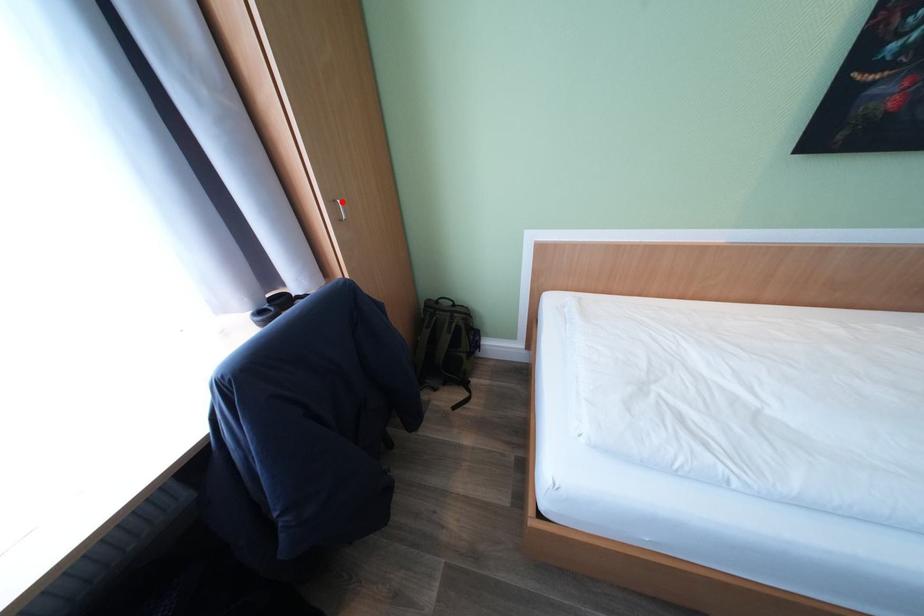
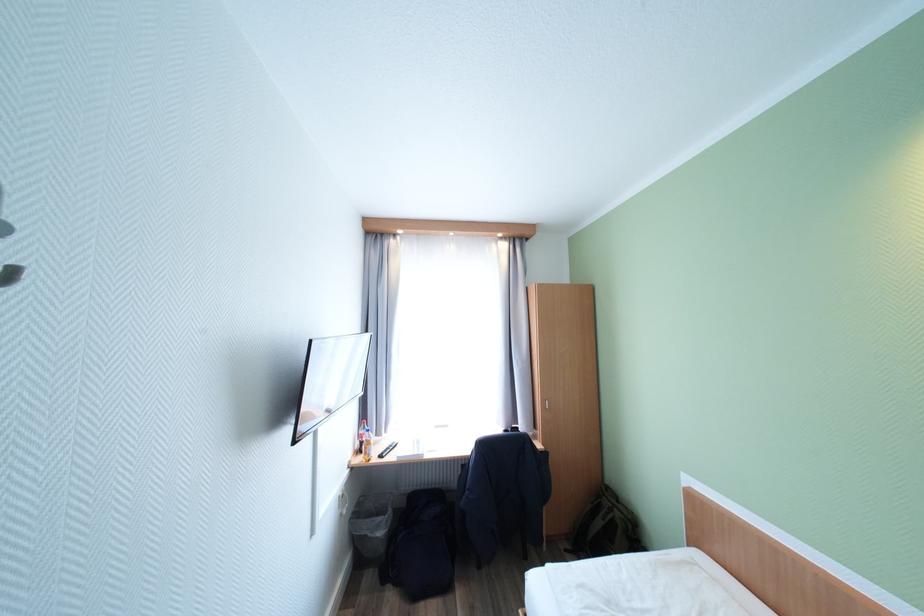
Find the pixel in the second image that matches the highlighted location in the first image.

(553, 402)